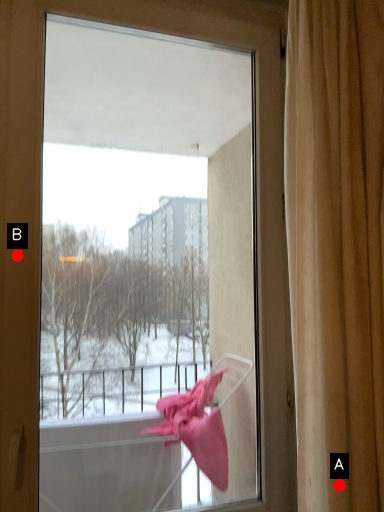
Question: Two points are circled on the image, labeled by A and B beside each circle. Which point is closer to the camera?

Choices:
 (A) A is closer
 (B) B is closer

Answer: (A)